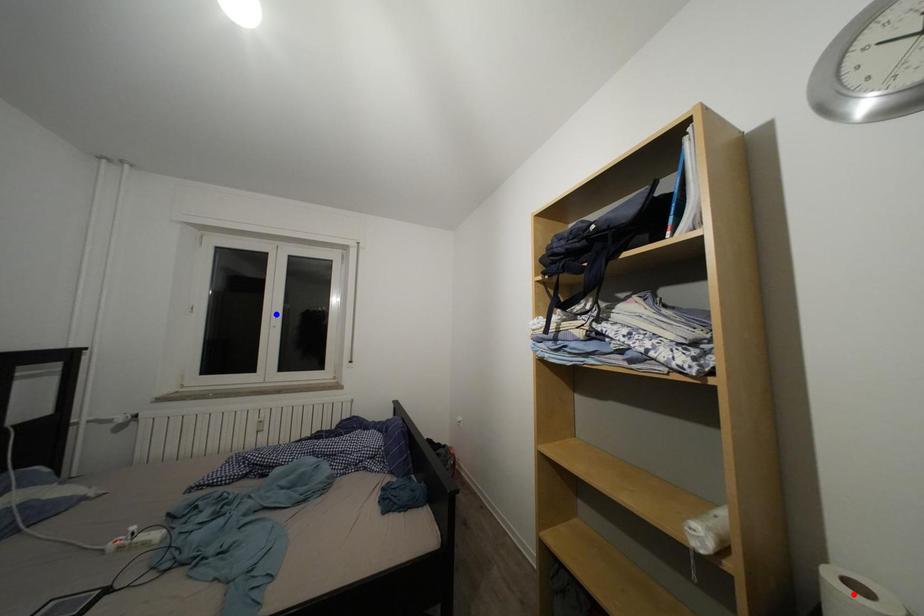
Question: Which of the two points in the image is closer to the camera?

Choices:
 (A) Blue point is closer.
 (B) Red point is closer.

Answer: (B)